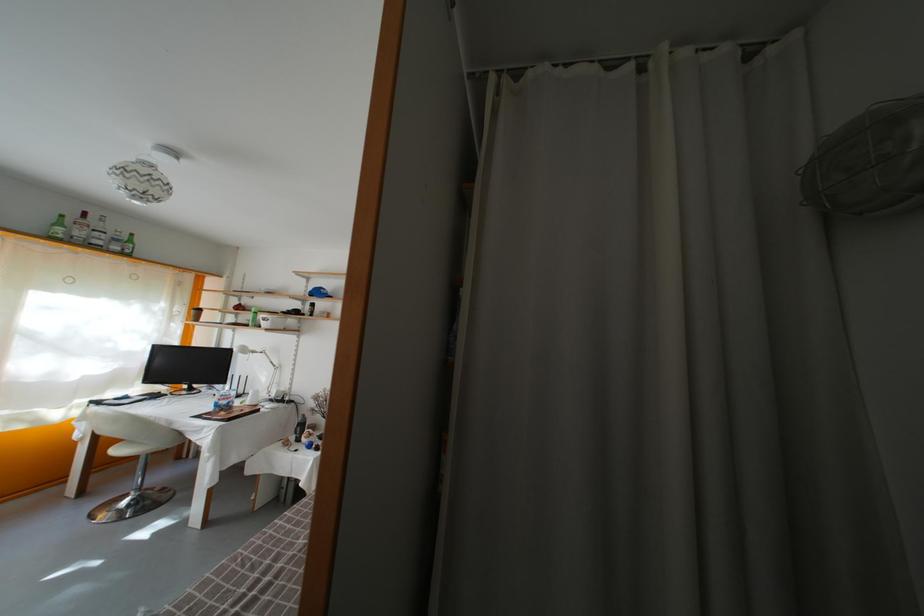
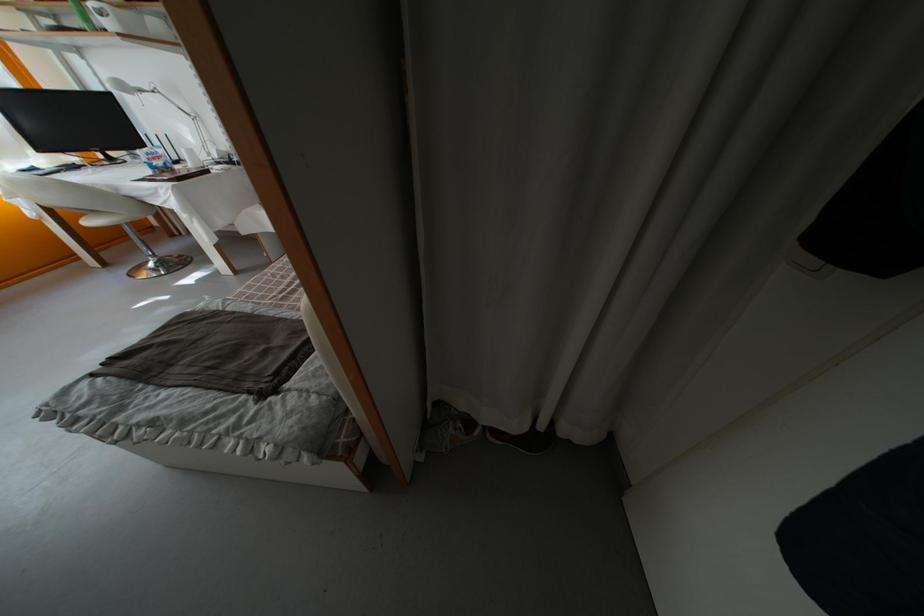
Where in the second image is the point corresponding to [257,355] from the first image?

(139, 91)